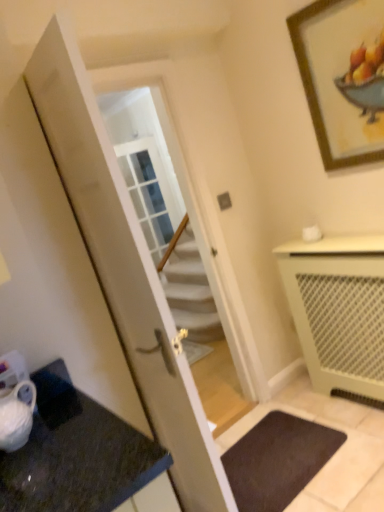
Image resolution: width=384 pixels, height=512 pixels. Describe the element at coordinates (338, 310) in the screenshot. I see `beige mesh radiator at lower right` at that location.

This screenshot has height=512, width=384. What are the coordinates of `dark brown carpet at lower center` in the screenshot? It's located at (277, 460).

Locate an element on the screen. The height and width of the screenshot is (512, 384). wooden framed artwork at upper right is located at coordinates (343, 77).

Which object is closer to the camera taking this photo, wooden framed artwork at upper right or white glossy door at center?

white glossy door at center is more forward.

Is wooden framed artwork at upper right oriented towards white glossy door at center?

Yes, wooden framed artwork at upper right is aimed at white glossy door at center.

In the scene shown: Can you confirm if wooden framed artwork at upper right is taller than white glossy door at center?

No.

Does point (348, 137) appear closer or farther from the camera than point (110, 251)?

Point (348, 137) appears to be farther away from the viewer than point (110, 251).

Is white glossy door at center to the left or to the right of beige mesh radiator at lower right in the image?

Clearly, white glossy door at center is on the left of beige mesh radiator at lower right in the image.

Consider the image. Is white glossy door at center taller than beige mesh radiator at lower right?

Indeed, white glossy door at center has a greater height compared to beige mesh radiator at lower right.

Does white glossy door at center have a lesser width compared to beige mesh radiator at lower right?

Yes.

This screenshot has height=512, width=384. I want to click on cabinetry that appears above the dark brown carpet at lower center (from the image's perspective), so click(x=338, y=310).

From a real-world perspective, between beige mesh radiator at lower right and dark brown carpet at lower center, who is vertically higher?

beige mesh radiator at lower right, from a real-world perspective.

Which of these two, beige mesh radiator at lower right or dark brown carpet at lower center, stands taller?

beige mesh radiator at lower right.

Is beige mesh radiator at lower right turned away from dark brown carpet at lower center?

No, beige mesh radiator at lower right is not facing the opposite direction of dark brown carpet at lower center.

Which is behind, white glossy door at center or wooden framed artwork at upper right?

wooden framed artwork at upper right is more distant.

Considering the positions of objects white glossy door at center and wooden framed artwork at upper right in the image provided, who is more to the right, white glossy door at center or wooden framed artwork at upper right?

Positioned to the right is wooden framed artwork at upper right.

Considering the positions of points (43, 49) and (352, 42), is point (43, 49) closer to camera compared to point (352, 42)?

Yes, it is.

Is wooden framed artwork at upper right positioned behind dark brown carpet at lower center?

No, wooden framed artwork at upper right is closer to the viewer.

Which object is wider, wooden framed artwork at upper right or dark brown carpet at lower center?

With larger width is dark brown carpet at lower center.

Is wooden framed artwork at upper right turned away from dark brown carpet at lower center?

That's not correct — wooden framed artwork at upper right is not looking away from dark brown carpet at lower center.

Is point (349, 164) farther from viewer compared to point (257, 433)?

No.

Which object is positioned more to the left, beige mesh radiator at lower right or wooden framed artwork at upper right?

wooden framed artwork at upper right.

Which is closer to the camera, (342, 332) or (348, 39)?

Point (342, 332) is farther from the camera than point (348, 39).

Is beige mesh radiator at lower right far from wooden framed artwork at upper right?

beige mesh radiator at lower right is actually quite close to wooden framed artwork at upper right.

From the image's perspective, who appears lower, beige mesh radiator at lower right or wooden framed artwork at upper right?

From the image's view, beige mesh radiator at lower right is below.

Does point (325, 435) lie behind point (325, 386)?

That is False.

Considering the sizes of objects dark brown carpet at lower center and beige mesh radiator at lower right in the image provided, who is thinner, dark brown carpet at lower center or beige mesh radiator at lower right?

With smaller width is beige mesh radiator at lower right.

Which object is closer to the camera taking this photo, dark brown carpet at lower center or beige mesh radiator at lower right?

dark brown carpet at lower center is in front.

Based on the photo, which object is positioned more to the left, dark brown carpet at lower center or beige mesh radiator at lower right?

dark brown carpet at lower center is more to the left.

In order to click on door in front of the wooden framed artwork at upper right in this screenshot , I will do `click(125, 268)`.

You are a GUI agent. You are given a task and a screenshot of the screen. Output one action in this format:
    pyautogui.click(x=<x>, y=<y>)
    Task: Click on the cabinetry lying below the white glossy door at center (from the image's perspective)
    The image size is (384, 512).
    Given the screenshot: What is the action you would take?
    pyautogui.click(x=338, y=310)

Consider the image. From the image, which object appears to be nearer to beige mesh radiator at lower right, white glossy door at center or dark brown carpet at lower center?

The object closer to beige mesh radiator at lower right is dark brown carpet at lower center.

Which object lies further to the anchor point wooden framed artwork at upper right, dark brown carpet at lower center or beige mesh radiator at lower right?

dark brown carpet at lower center is positioned further to the anchor wooden framed artwork at upper right.

Which object lies nearer to the anchor point wooden framed artwork at upper right, beige mesh radiator at lower right or dark brown carpet at lower center?

Based on the image, beige mesh radiator at lower right appears to be nearer to wooden framed artwork at upper right.

Which object lies further to the anchor point dark brown carpet at lower center, wooden framed artwork at upper right or white glossy door at center?

wooden framed artwork at upper right is further to dark brown carpet at lower center.

Which object lies nearer to the anchor point beige mesh radiator at lower right, dark brown carpet at lower center or wooden framed artwork at upper right?

The object closer to beige mesh radiator at lower right is dark brown carpet at lower center.

Based on their spatial positions, is beige mesh radiator at lower right or wooden framed artwork at upper right further from white glossy door at center?

Based on the image, wooden framed artwork at upper right appears to be further to white glossy door at center.

Considering their positions, is white glossy door at center positioned further to wooden framed artwork at upper right than dark brown carpet at lower center?

dark brown carpet at lower center is further to wooden framed artwork at upper right.

From the image, which object appears to be nearer to dark brown carpet at lower center, wooden framed artwork at upper right or beige mesh radiator at lower right?

The object closer to dark brown carpet at lower center is beige mesh radiator at lower right.

The height and width of the screenshot is (512, 384). I want to click on bath mat located between white glossy door at center and beige mesh radiator at lower right in the left-right direction, so click(277, 460).

This screenshot has width=384, height=512. What are the coordinates of `door between wooden framed artwork at upper right and beige mesh radiator at lower right in the vertical direction` in the screenshot? It's located at (125, 268).

Where is `door that lies between wooden framed artwork at upper right and dark brown carpet at lower center from top to bottom`? The image size is (384, 512). door that lies between wooden framed artwork at upper right and dark brown carpet at lower center from top to bottom is located at coordinates (125, 268).

Identify the location of cabinetry that lies between wooden framed artwork at upper right and dark brown carpet at lower center from top to bottom. This screenshot has height=512, width=384. (338, 310).